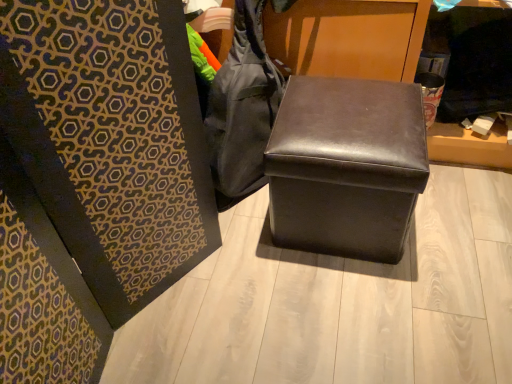
What is the approximate width of matte brown ottoman at center?

matte brown ottoman at center is 17.53 inches wide.

The width and height of the screenshot is (512, 384). What do you see at coordinates (346, 166) in the screenshot? I see `matte brown ottoman at center` at bounding box center [346, 166].

Measure the distance between point (374,153) and camera.

Point (374,153) and camera are 3.43 feet apart.

Image resolution: width=512 pixels, height=384 pixels. In order to click on matte brown ottoman at center in this screenshot , I will do `click(346, 166)`.

You are a GUI agent. You are given a task and a screenshot of the screen. Output one action in this format:
    pyautogui.click(x=<x>, y=<y>)
    Task: Click on the matte brown ottoman at center
    The height and width of the screenshot is (384, 512).
    Given the screenshot: What is the action you would take?
    pyautogui.click(x=346, y=166)